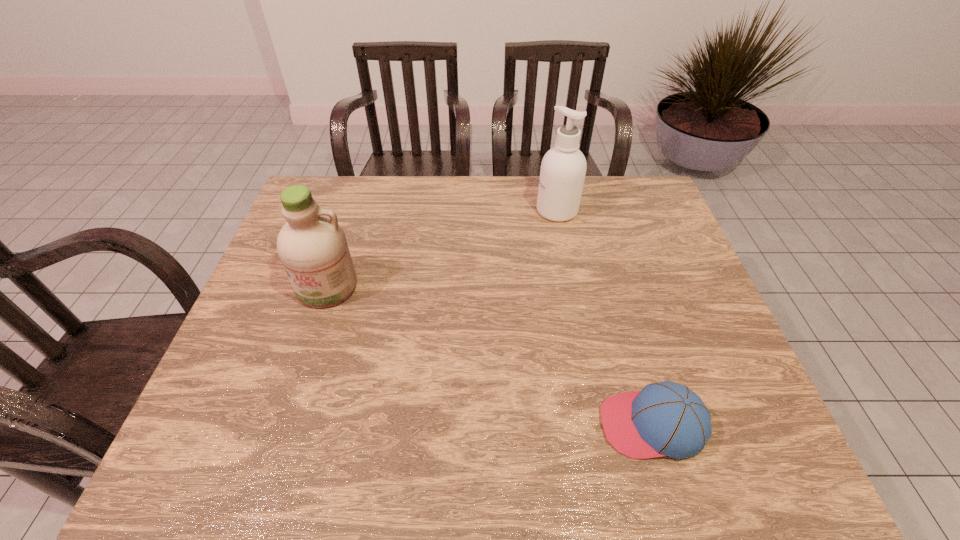
Identify the location of vacant space located on the front-facing side of the shortest object. Image resolution: width=960 pixels, height=540 pixels. (493, 425).

Where is `vacant space located 0.340m on the front-facing side of the shortest object`? vacant space located 0.340m on the front-facing side of the shortest object is located at coordinates (436, 425).

Identify the location of free region located on the front-facing side of the shortest object. (421, 425).

Locate an element on the screen. The width and height of the screenshot is (960, 540). object present at the far edge is located at coordinates (563, 168).

At what (x,y) coordinates should I click in order to perform the action: click on object that is positioned at the near edge. Please return your answer as a coordinate pair (x, y). Looking at the image, I should click on (668, 419).

The width and height of the screenshot is (960, 540). In order to click on object that is at the left edge in this screenshot , I will do `click(312, 246)`.

At what (x,y) coordinates should I click in order to perform the action: click on object at the right edge. Please return your answer as a coordinate pair (x, y). This screenshot has width=960, height=540. Looking at the image, I should click on (668, 419).

At what (x,y) coordinates should I click in order to perform the action: click on object at the near right corner. Please return your answer as a coordinate pair (x, y). Looking at the image, I should click on (668, 419).

Find the location of a particular element. This screenshot has height=540, width=960. vacant space at the far edge of the desktop is located at coordinates (585, 183).

In the image, there is a desktop. Where is `free space at the near edge`? Image resolution: width=960 pixels, height=540 pixels. free space at the near edge is located at coordinates (570, 447).